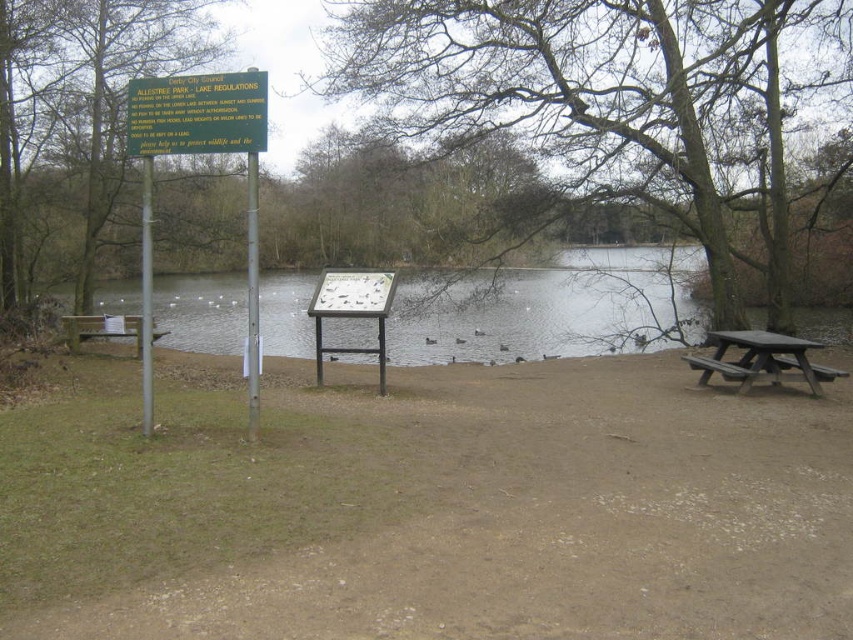
Question: Can you confirm if bare branches at center is positioned below brown wooden bench at left?

Choices:
 (A) no
 (B) yes

Answer: (A)

Question: Observing the image, what is the correct spatial positioning of green sign at left in reference to brown wooden bench at left?

Choices:
 (A) above
 (B) below

Answer: (A)

Question: Which of these objects is positioned closest to the green plastic sign at upper center?

Choices:
 (A) dark brown wooden picnic table at lower right
 (B) clear water at center

Answer: (A)

Question: Which point is farther from the camera taking this photo?

Choices:
 (A) (138, 330)
 (B) (712, 333)
 (C) (248, 122)

Answer: (A)

Question: Which object is closer to the camera taking this photo?

Choices:
 (A) green plastic sign at upper center
 (B) clear water at center
 (C) green sign at left
 (D) dark brown wooden picnic table at lower right

Answer: (A)

Question: Can you confirm if green sign at left is positioned to the right of brown wooden bench at left?

Choices:
 (A) no
 (B) yes

Answer: (A)